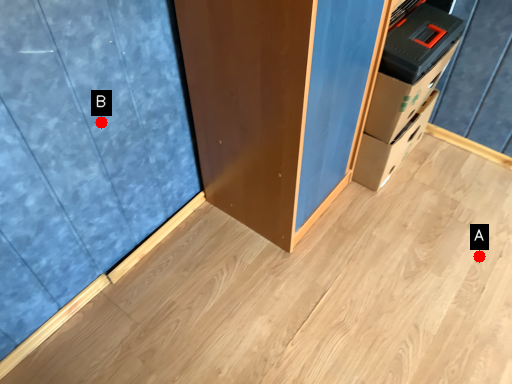
Question: Two points are circled on the image, labeled by A and B beside each circle. Which point is farther from the camera taking this photo?

Choices:
 (A) A is further
 (B) B is further

Answer: (A)